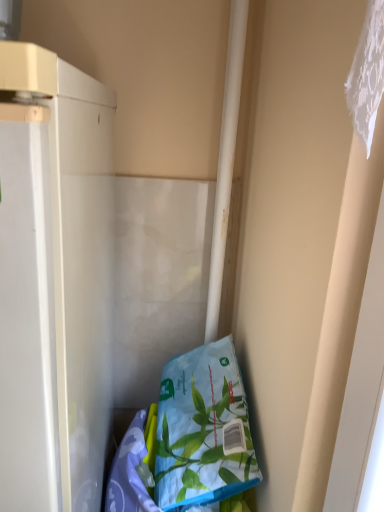
This screenshot has height=512, width=384. Describe the element at coordinates (203, 430) in the screenshot. I see `blue printed tote bag at lower right` at that location.

Locate an element on the screen. blue printed tote bag at lower right is located at coordinates (203, 430).

Looking at this image, in order to face blue printed tote bag at lower right, should I rotate leftwards or rightwards?

Turn right approximately 0.738 degrees to face it.

This screenshot has height=512, width=384. Identify the location of blue printed tote bag at lower right. (203, 430).